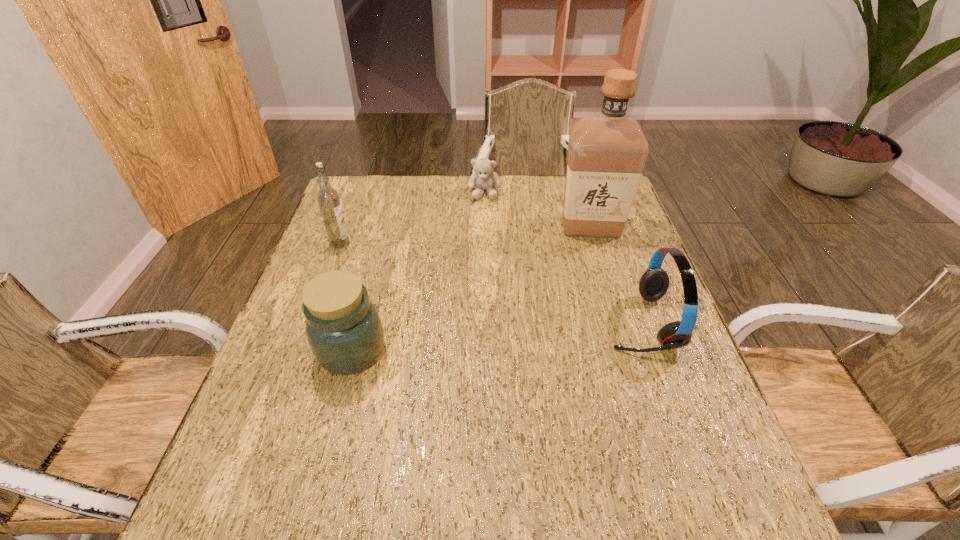
Where is `vacant space on the desktop that is between the jar and the headset and is positioned on the label of the fourth shortest object`? The image size is (960, 540). vacant space on the desktop that is between the jar and the headset and is positioned on the label of the fourth shortest object is located at coordinates (502, 336).

Locate an element on the screen. This screenshot has width=960, height=540. free space on the desktop that is between the fourth object from right to left and the headset and is positioned on the front-facing side of the tallest object is located at coordinates (489, 337).

Locate an element on the screen. This screenshot has height=540, width=960. free spot on the desktop that is between the jar and the headset and is positioned on the face of the teddy bear is located at coordinates (471, 339).